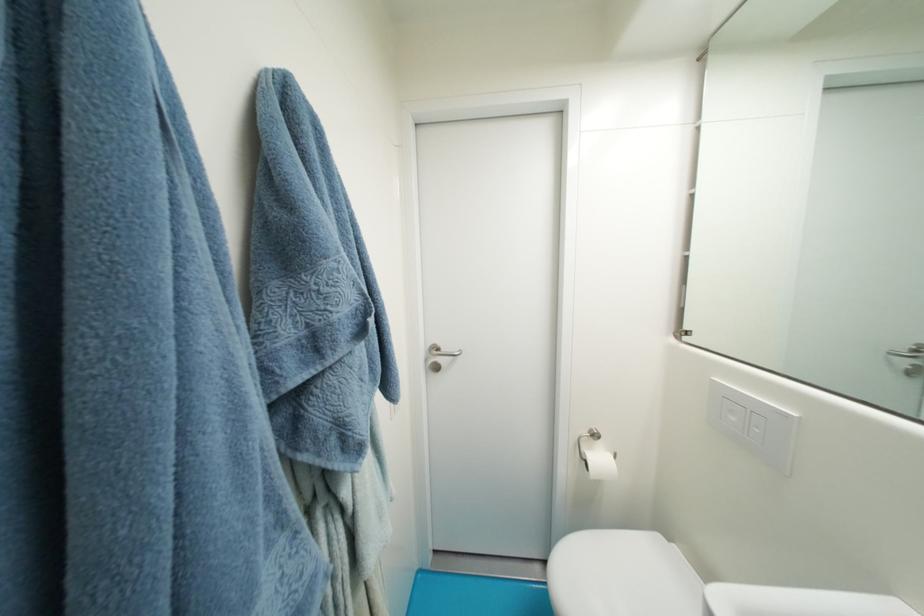
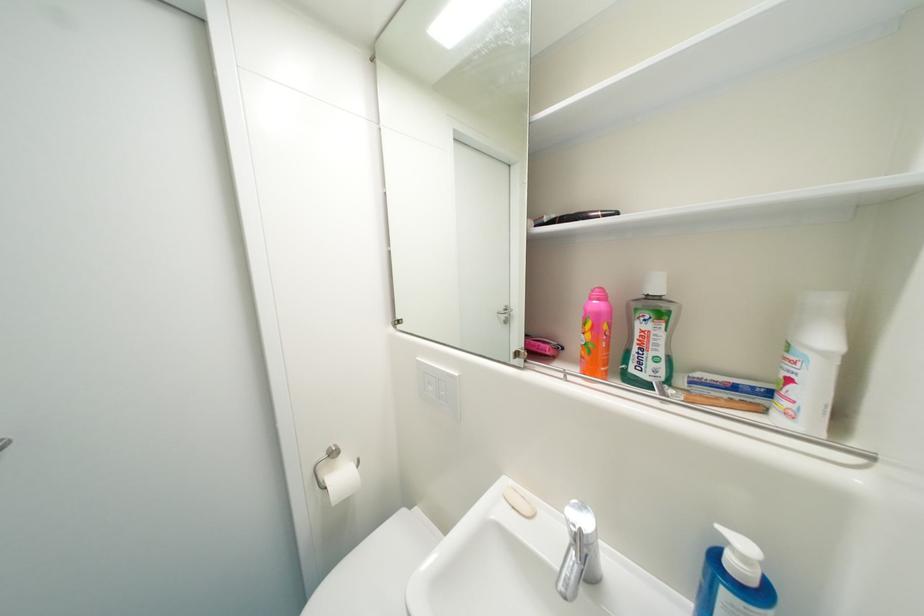
Question: The camera is either moving clockwise (left) or counter-clockwise (right) around the object. The first image is from the beginning of the video and the second image is from the end. Is the camera moving left or right when shooting the video?

Choices:
 (A) Left
 (B) Right

Answer: (A)